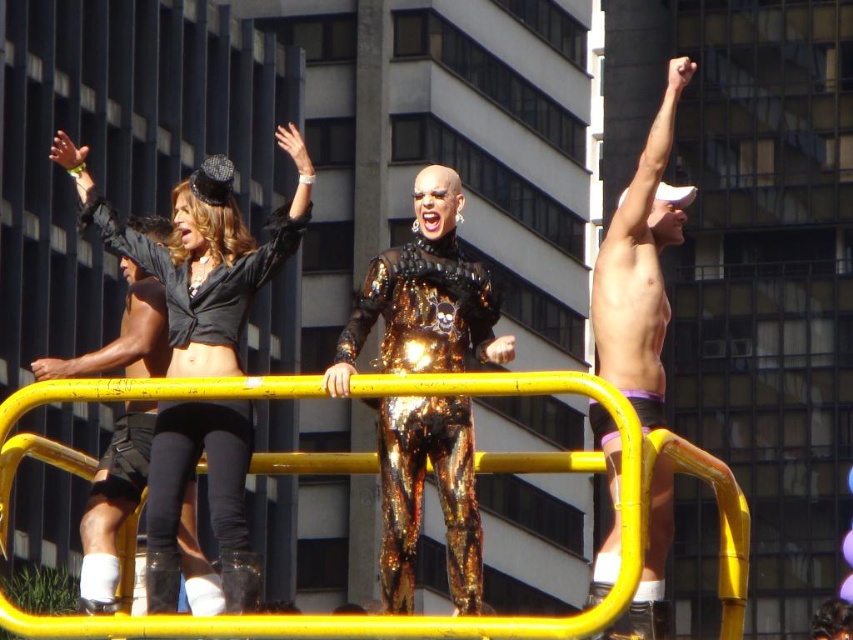
Question: Can you confirm if yellow metallic rail at center is thinner than matte black top at upper left?

Choices:
 (A) no
 (B) yes

Answer: (A)

Question: Which point is closer to the camera?

Choices:
 (A) shiny metallic suit at center
 (B) yellow metallic rail at center
 (C) shiny metallic shorts at upper right
 (D) matte black top at upper left

Answer: (B)

Question: Among these objects, which one is nearest to the camera?

Choices:
 (A) matte black top at upper left
 (B) yellow metallic rail at center

Answer: (B)

Question: Does yellow metallic rail at center lie behind matte black top at upper left?

Choices:
 (A) yes
 (B) no

Answer: (B)

Question: Which object is farther from the camera taking this photo?

Choices:
 (A) yellow metallic rail at center
 (B) shiny metallic suit at center
 (C) matte black top at upper left

Answer: (C)

Question: Does matte black top at upper left have a smaller size compared to shiny metallic suit at center?

Choices:
 (A) no
 (B) yes

Answer: (A)